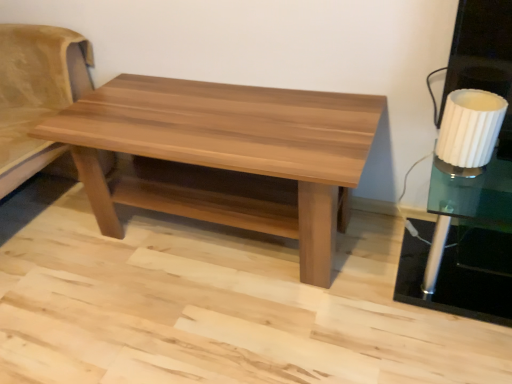
Question: Choose the correct answer: Is suede beige futon at left inside light brown wood coffee table at center or outside it?

Choices:
 (A) outside
 (B) inside

Answer: (A)

Question: In the image, is suede beige futon at left on the left side or the right side of light brown wood coffee table at center?

Choices:
 (A) right
 (B) left

Answer: (B)

Question: Which is nearer to the suede beige futon at left?

Choices:
 (A) white ribbed glass at right
 (B) white ribbed glass side table at right
 (C) light brown wood coffee table at center

Answer: (C)

Question: Which object is positioned closest to the white ribbed glass side table at right?

Choices:
 (A) light brown wood coffee table at center
 (B) suede beige futon at left
 (C) white ribbed glass at right

Answer: (C)